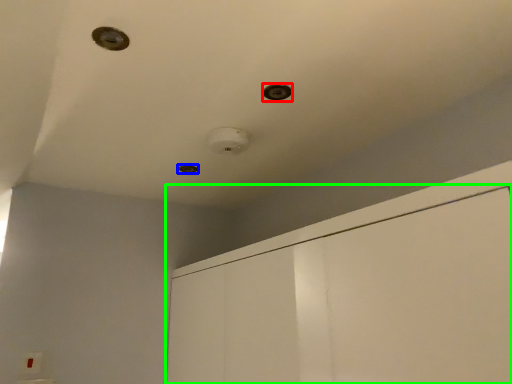
Question: Considering the real-world distances, which object is farthest from hole (highlighted by a red box)? hole (highlighted by a blue box) or dresser (highlighted by a green box)?

Choices:
 (A) hole
 (B) dresser

Answer: (A)